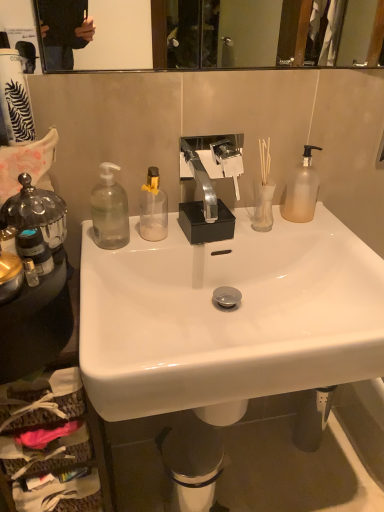
Find the location of `free space in front of frosted glass pump bottle at upper right, the 3th bottle from the left`. free space in front of frosted glass pump bottle at upper right, the 3th bottle from the left is located at coordinates (319, 234).